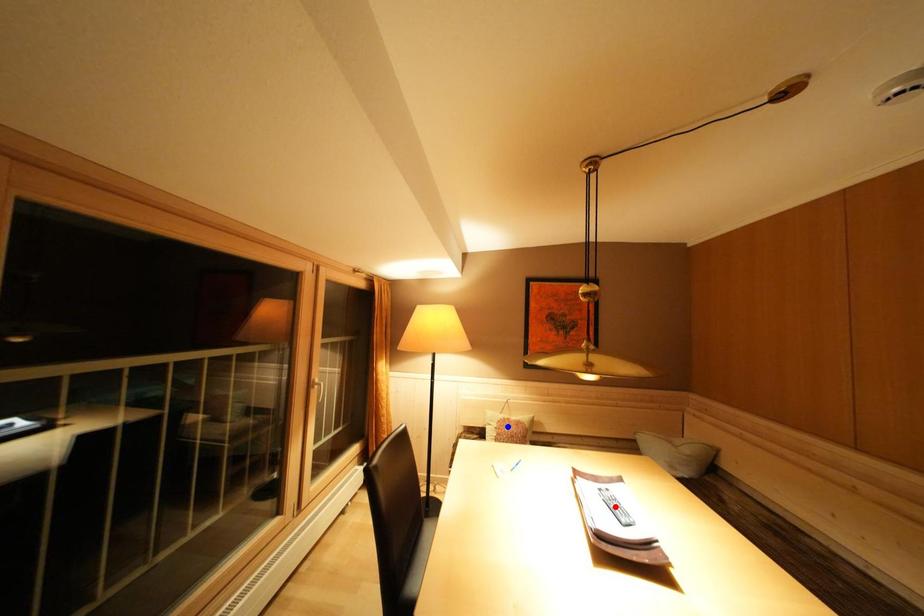
Question: Two points are marked on the image. Which point is closer to the camera?

Choices:
 (A) Blue point is closer.
 (B) Red point is closer.

Answer: (B)